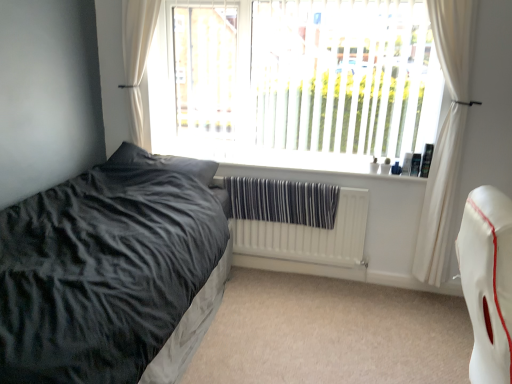
Question: From the image's perspective, is white leather swivel chair at right positioned above or below dark grey plush pillow at left?

Choices:
 (A) above
 (B) below

Answer: (B)

Question: Is point (467, 241) closer or farther from the camera than point (204, 162)?

Choices:
 (A) closer
 (B) farther

Answer: (A)

Question: Estimate the real-world distances between objects in this image. Which object is closer to the white sheer curtain at right, which ranks as the second curtain in left-to-right order?

Choices:
 (A) white matte window sill at center
 (B) white fabric curtain at upper left, the second curtain viewed from the right
 (C) white leather swivel chair at right
 (D) velvet black bed at left
 (E) white textured radiator at center

Answer: (E)

Question: Which object is positioned closest to the white fabric curtain at upper left, the 1th curtain when ordered from left to right?

Choices:
 (A) white sheer curtain at right, which ranks as the first curtain in right-to-left order
 (B) white leather swivel chair at right
 (C) dark grey plush pillow at left
 (D) white plastic window at upper center
 (E) white matte window sill at center

Answer: (C)